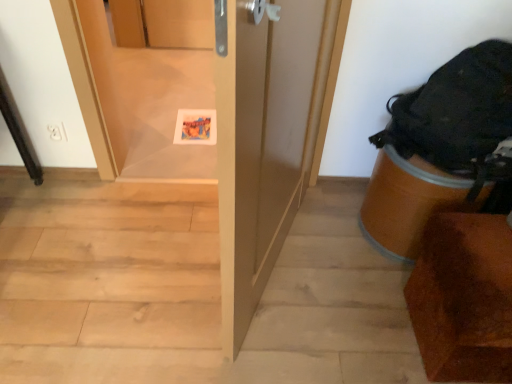
Where is `vacant space that is to the left of brown wood chair at lower right`? The height and width of the screenshot is (384, 512). vacant space that is to the left of brown wood chair at lower right is located at coordinates (367, 314).